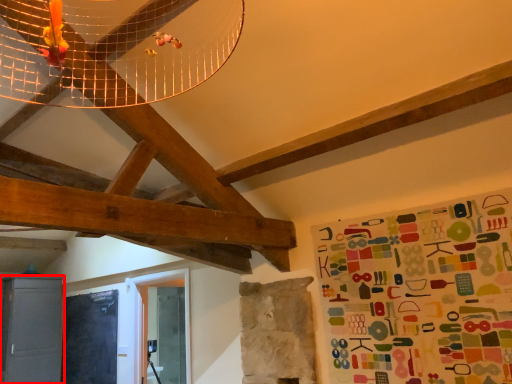
Question: From the image, what is the correct spatial relationship of cabinetry (annotated by the red box) in relation to bulletin board?

Choices:
 (A) left
 (B) right

Answer: (A)